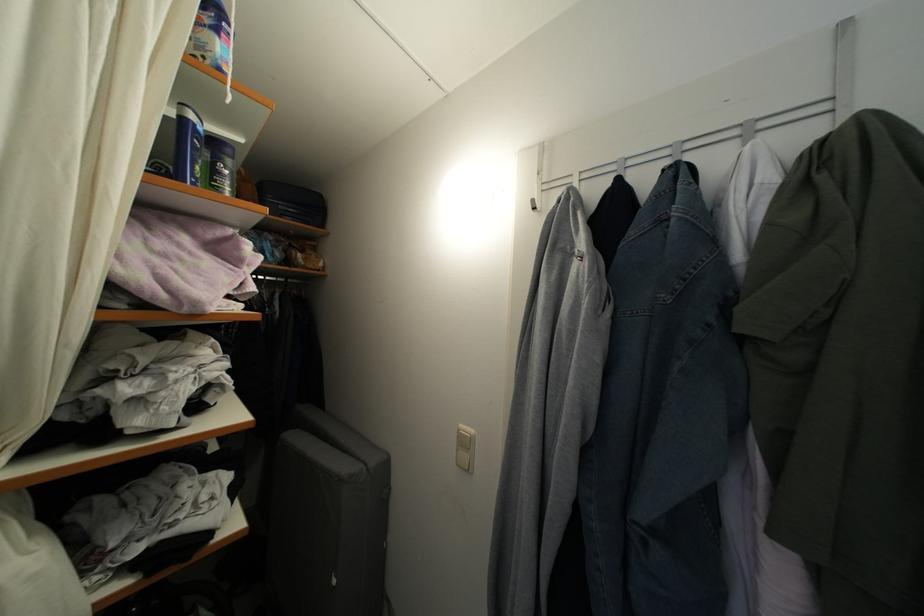
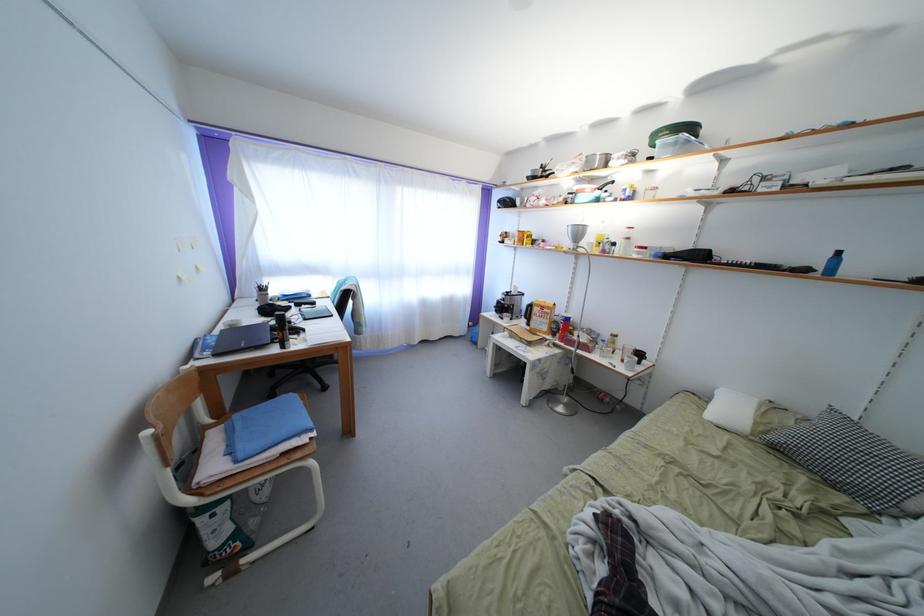
Question: The camera is either moving clockwise (left) or counter-clockwise (right) around the object. The first image is from the beginning of the video and the second image is from the end. Is the camera moving left or right when shooting the video?

Choices:
 (A) Left
 (B) Right

Answer: (B)